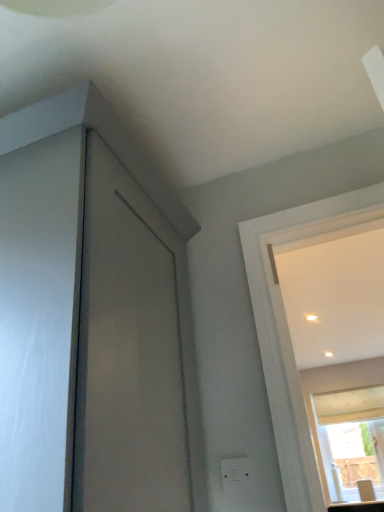
You are a GUI agent. You are given a task and a screenshot of the screen. Output one action in this format:
    pyautogui.click(x=<x>, y=<y>)
    Task: Click on the white plastic electric outlet at lower center
    The width and height of the screenshot is (384, 512).
    Given the screenshot: What is the action you would take?
    pyautogui.click(x=236, y=475)

The height and width of the screenshot is (512, 384). Describe the element at coordinates (236, 475) in the screenshot. I see `white plastic electric outlet at lower center` at that location.

The height and width of the screenshot is (512, 384). Find the location of `matte white countertop at lower right`. matte white countertop at lower right is located at coordinates (357, 506).

Find the location of a particular element. transparent glass window at upper right is located at coordinates click(x=349, y=436).

Does white plastic electric outlet at lower center have a lesser width compared to transparent glass window at upper right?

Yes.

Which is closer, (237, 466) or (349, 448)?

Point (237, 466) is closer to the camera than point (349, 448).

Is white plastic electric outlet at lower center at the left side of transparent glass window at upper right?

Yes.

Can you tell me how much white plastic electric outlet at lower center and transparent glass window at upper right differ in facing direction?

The angular difference between white plastic electric outlet at lower center and transparent glass window at upper right is 0.444 degrees.

Can you confirm if white plastic electric outlet at lower center is wider than matte white countertop at lower right?

No.

In the scene shown: In terms of height, does white plastic electric outlet at lower center look taller or shorter compared to matte white countertop at lower right?

white plastic electric outlet at lower center is taller than matte white countertop at lower right.

From a real-world perspective, which is physically above, white plastic electric outlet at lower center or matte white countertop at lower right?

From a 3D spatial view, white plastic electric outlet at lower center is above.

This screenshot has height=512, width=384. What are the coordinates of `counter top lying behind the white plastic electric outlet at lower center` in the screenshot? It's located at (357, 506).

Measure the distance from transparent glass window at upper right to white plastic electric outlet at lower center.

transparent glass window at upper right and white plastic electric outlet at lower center are 3.47 meters apart.

Does point (341, 435) come closer to viewer compared to point (226, 479)?

No.

Between transparent glass window at upper right and white plastic electric outlet at lower center, which one appears on the right side from the viewer's perspective?

transparent glass window at upper right.

Do you think transparent glass window at upper right is within white plastic electric outlet at lower center, or outside of it?

transparent glass window at upper right is not enclosed by white plastic electric outlet at lower center.

From the image's perspective, is matte white countertop at lower right positioned above or below white plastic electric outlet at lower center?

matte white countertop at lower right is situated lower than white plastic electric outlet at lower center in the image.

Is matte white countertop at lower right outside of white plastic electric outlet at lower center?

matte white countertop at lower right is positioned outside white plastic electric outlet at lower center.

Does point (381, 507) appear closer or farther from the camera than point (224, 489)?

Point (381, 507) is farther from the camera than point (224, 489).

Considering their positions, is matte white countertop at lower right located in front of or behind white plastic electric outlet at lower center?

Clearly, matte white countertop at lower right is behind white plastic electric outlet at lower center.

Between transparent glass window at upper right and matte white countertop at lower right, which one has smaller width?

transparent glass window at upper right is thinner.

Which object is closer to the camera, transparent glass window at upper right or matte white countertop at lower right?

matte white countertop at lower right is in front.

Is transparent glass window at upper right positioned with its back to matte white countertop at lower right?

No.

From the image's perspective, is transparent glass window at upper right under matte white countertop at lower right?

No.

From a real-world perspective, is matte white countertop at lower right physically located above or below transparent glass window at upper right?

matte white countertop at lower right is below transparent glass window at upper right.

Is point (353, 504) closer or farther from the camera than point (368, 477)?

Point (353, 504) is closer to the camera than point (368, 477).

Is matte white countertop at lower right aimed at transparent glass window at upper right?

No, matte white countertop at lower right is not turned towards transparent glass window at upper right.

Is matte white countertop at lower right shorter than transparent glass window at upper right?

Indeed, matte white countertop at lower right has a lesser height compared to transparent glass window at upper right.

Locate an element on the screen. electric outlet that is on the left side of transparent glass window at upper right is located at coordinates (236, 475).

This screenshot has height=512, width=384. Identify the location of electric outlet in front of the matte white countertop at lower right. (236, 475).

Considering their positions, is white plastic electric outlet at lower center positioned closer to transparent glass window at upper right than matte white countertop at lower right?

matte white countertop at lower right lies closer to transparent glass window at upper right than the other object.

From the image, which object appears to be nearer to matte white countertop at lower right, white plastic electric outlet at lower center or transparent glass window at upper right?

transparent glass window at upper right lies closer to matte white countertop at lower right than the other object.

Looking at the image, which one is located further to white plastic electric outlet at lower center, transparent glass window at upper right or matte white countertop at lower right?

transparent glass window at upper right is further to white plastic electric outlet at lower center.

Estimate the real-world distances between objects in this image. Which object is closer to transparent glass window at upper right, matte white countertop at lower right or white plastic electric outlet at lower center?

matte white countertop at lower right is closer to transparent glass window at upper right.

When comparing their distances from matte white countertop at lower right, does transparent glass window at upper right or white plastic electric outlet at lower center seem closer?

Based on the image, transparent glass window at upper right appears to be nearer to matte white countertop at lower right.

Looking at the image, which one is located further to white plastic electric outlet at lower center, matte white countertop at lower right or transparent glass window at upper right?

transparent glass window at upper right is positioned further to the anchor white plastic electric outlet at lower center.

Find the location of a particular element. counter top located between white plastic electric outlet at lower center and transparent glass window at upper right in the depth direction is located at coordinates (357, 506).